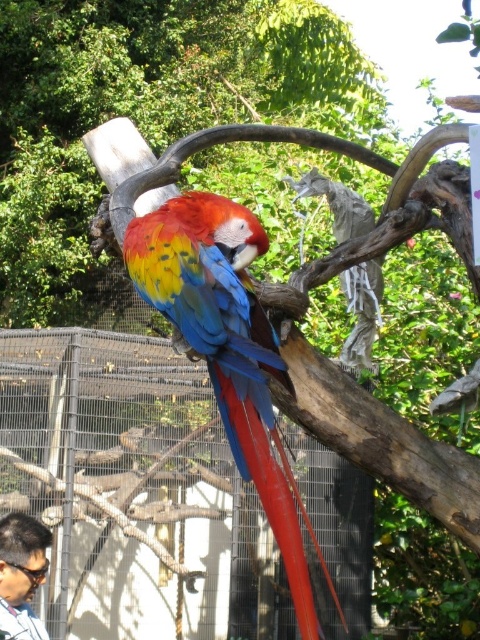
Question: From the image, what is the correct spatial relationship of shiny multicolored parrot at center in relation to dark brown hair at lower left?

Choices:
 (A) above
 (B) below

Answer: (A)

Question: Does shiny multicolored parrot at center appear on the right side of dark brown hair at lower left?

Choices:
 (A) yes
 (B) no

Answer: (A)

Question: Which point appears closest to the camera in this image?

Choices:
 (A) (41, 538)
 (B) (266, 396)

Answer: (B)

Question: Which point is farther from the camera taking this photo?

Choices:
 (A) (44, 541)
 (B) (193, 307)

Answer: (A)

Question: Observing the image, what is the correct spatial positioning of shiny multicolored parrot at center in reference to dark brown hair at lower left?

Choices:
 (A) left
 (B) right

Answer: (B)